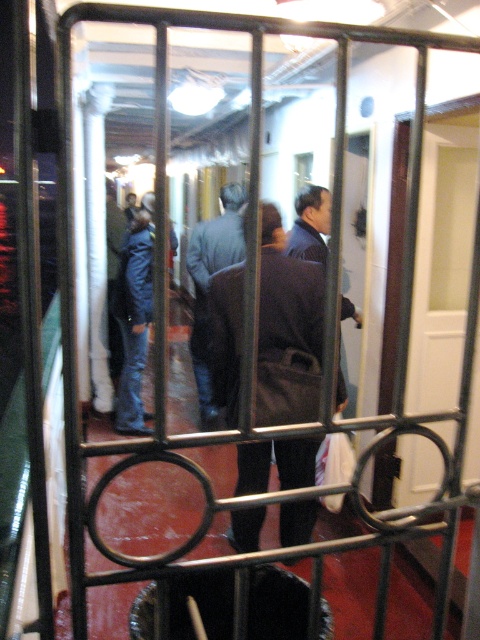
Which is in front, point (462, 230) or point (195, 252)?

Point (462, 230) is in front.

In the scene shown: Can you confirm if white matte door at right is positioned above dark gray suit at center?

No, white matte door at right is not above dark gray suit at center.

Who is more forward, (476,177) or (187,259)?

Point (476,177)

At what (x,y) coordinates should I click in order to perform the action: click on white matte door at right. Please return your answer as a coordinate pair (x, y). Looking at the image, I should click on (443, 260).

You are a GUI agent. You are given a task and a screenshot of the screen. Output one action in this format:
    pyautogui.click(x=<x>, y=<y>)
    Task: Click on the dark brown leather coat at center
    
    Given the screenshot: What is the action you would take?
    pyautogui.click(x=288, y=296)

Can you confirm if dark brown leather coat at center is taller than dark gray suit at center?

Incorrect, dark brown leather coat at center's height is not larger of dark gray suit at center's.

Does point (286, 314) lie in front of point (208, 257)?

Yes.

Image resolution: width=480 pixels, height=640 pixels. I want to click on dark brown leather coat at center, so click(288, 296).

Is white matte door at right further to the viewer compared to dark brown leather coat at center?

Yes, it is behind dark brown leather coat at center.

Who is positioned more to the right, white matte door at right or dark brown leather coat at center?

white matte door at right

Between point (417, 410) and point (239, 324), which one is positioned behind?

Point (417, 410)

Locate an element on the screen. This screenshot has width=480, height=640. white matte door at right is located at coordinates (443, 260).